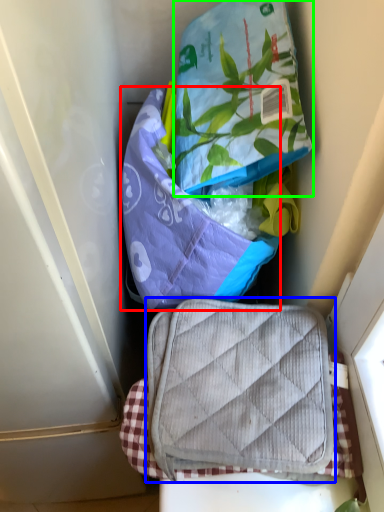
Question: Which object is the farthest from pouch (highlighted by a red box)? Choose among these: luggage and bags (highlighted by a blue box) or pouch (highlighted by a green box).

Choices:
 (A) luggage and bags
 (B) pouch

Answer: (A)